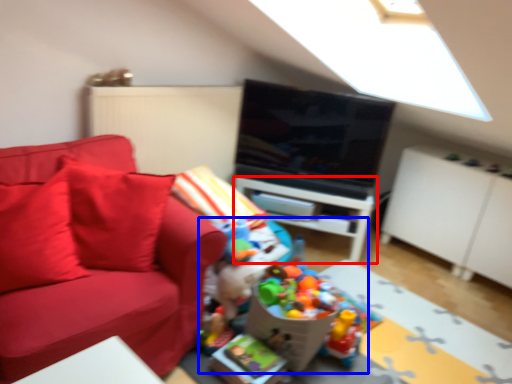
Question: Which object is closer to the camera taking this photo, table (highlighted by a red box) or toy (highlighted by a blue box)?

Choices:
 (A) table
 (B) toy

Answer: (B)